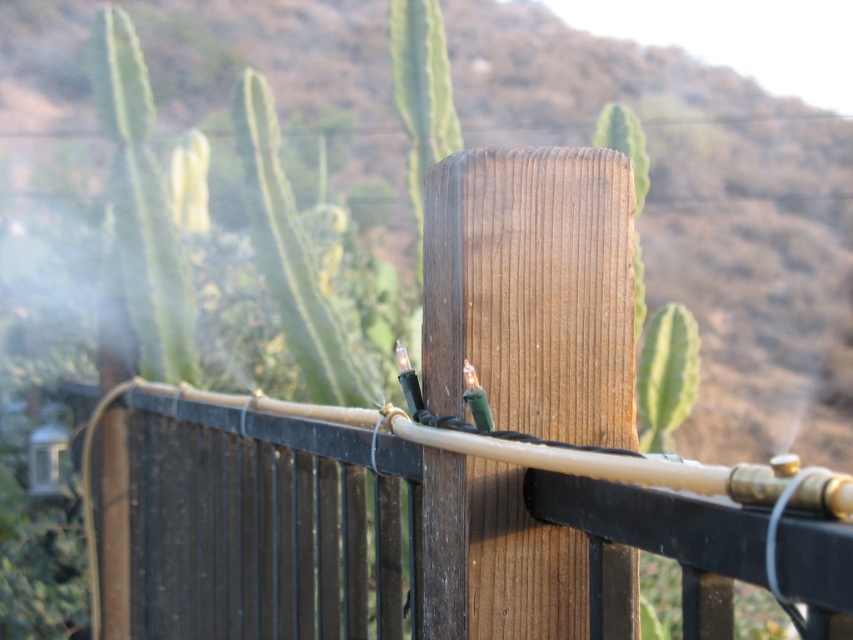
Question: Is brown wooden post at center bigger than brown wooden fence at center?

Choices:
 (A) yes
 (B) no

Answer: (A)

Question: Can you confirm if brown wooden post at center is smaller than brown wooden fence at center?

Choices:
 (A) yes
 (B) no

Answer: (B)

Question: Among these points, which one is nearest to the camera?

Choices:
 (A) (373, 77)
 (B) (236, 445)

Answer: (B)

Question: Which point is farther to the camera?

Choices:
 (A) brown wooden post at center
 (B) brown wooden fence at center

Answer: (A)

Question: Which object is farther from the camera taking this photo?

Choices:
 (A) brown wooden post at center
 (B) brown wooden fence at center

Answer: (A)

Question: Can you confirm if brown wooden post at center is positioned below brown wooden fence at center?

Choices:
 (A) yes
 (B) no

Answer: (B)